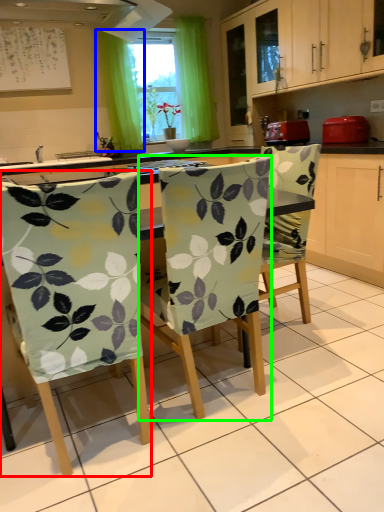
Question: Which object is positioned farthest from chair (highlighted by a red box)? Select from curtain (highlighted by a blue box) and chair (highlighted by a green box).

Choices:
 (A) curtain
 (B) chair

Answer: (A)